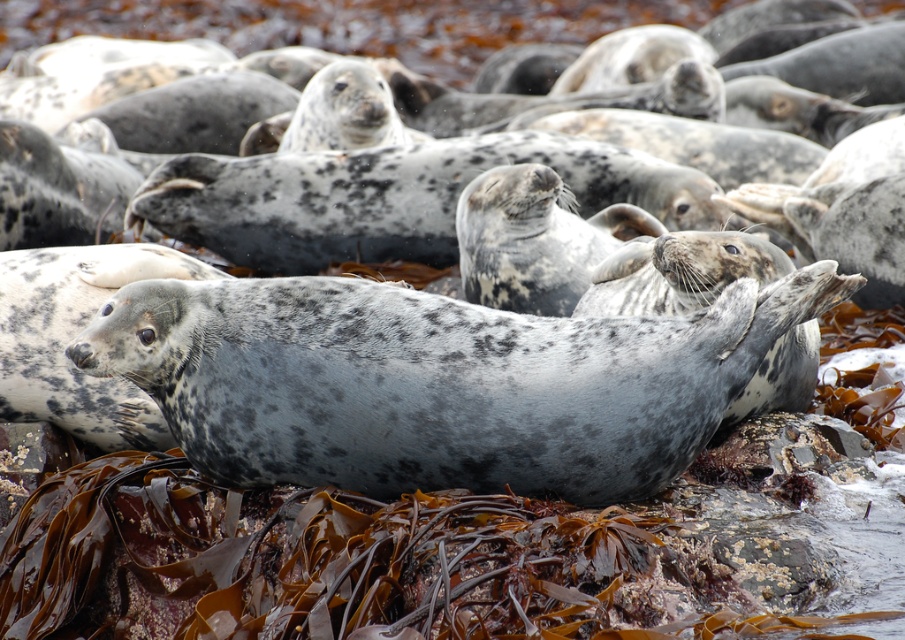
Question: Does spotted fur seal at center appear on the right side of speckled fur seal at center?

Choices:
 (A) no
 (B) yes

Answer: (B)

Question: Which of the following is the farthest from the observer?

Choices:
 (A) spotted fur seal at center
 (B) speckled fur seal at center

Answer: (B)

Question: Does spotted fur seal at center have a greater width compared to speckled fur seal at center?

Choices:
 (A) yes
 (B) no

Answer: (B)

Question: Among these objects, which one is farthest from the camera?

Choices:
 (A) spotted fur seal at center
 (B) speckled fur seal at center

Answer: (B)

Question: Does spotted fur seal at center appear under speckled fur seal at center?

Choices:
 (A) no
 (B) yes

Answer: (B)